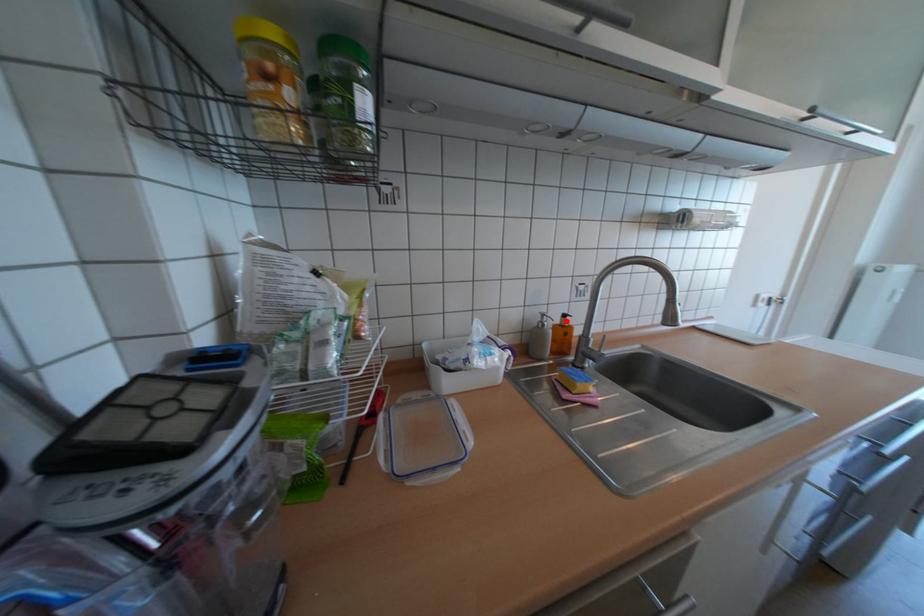
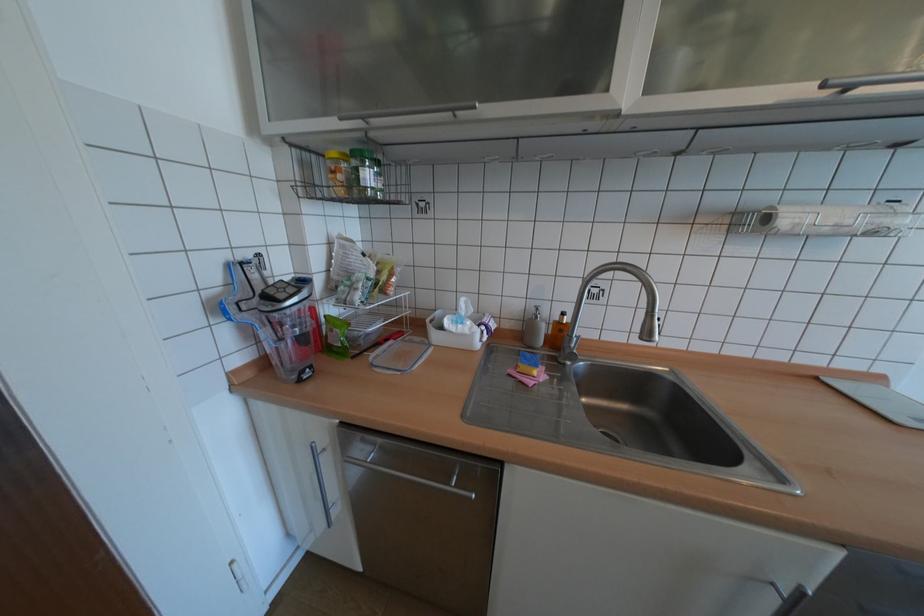
The point at the highlighted location is marked in the first image. Where is the corresponding point in the second image?

(565, 317)